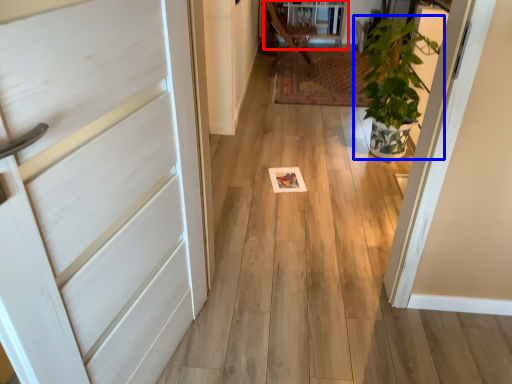
Question: Which of the following is the farthest to the observer, bookshelf (highlighted by a red box) or houseplant (highlighted by a blue box)?

Choices:
 (A) bookshelf
 (B) houseplant

Answer: (A)